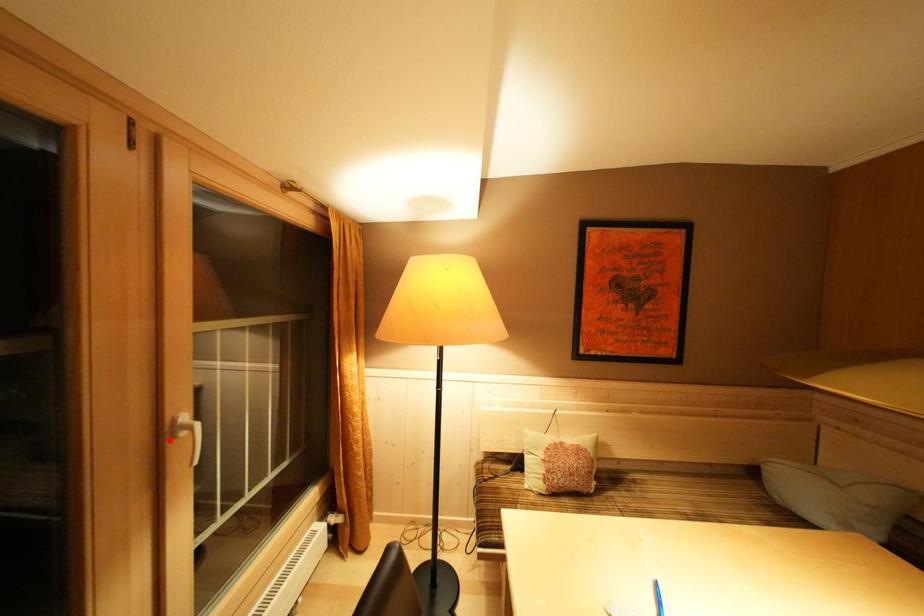
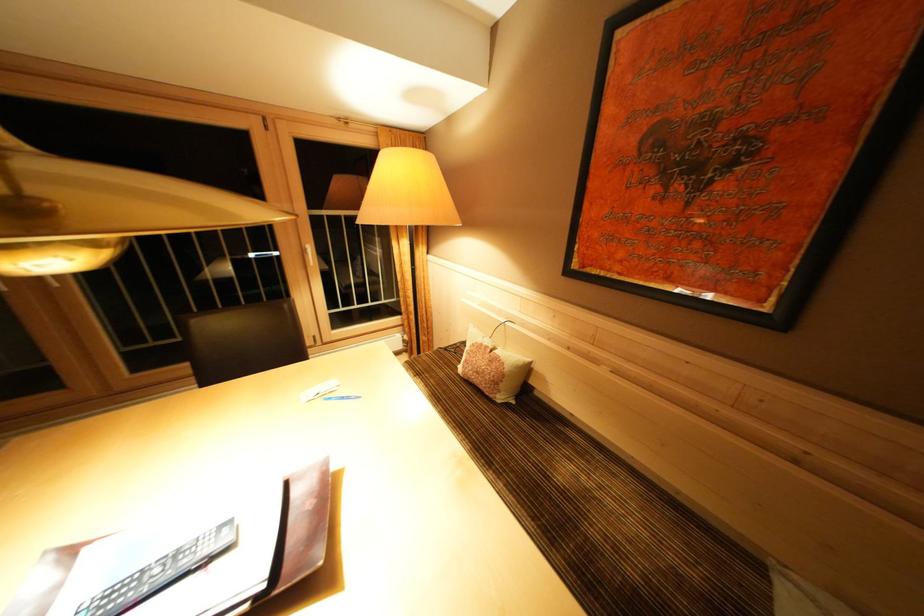
Question: I am providing you with two images of the same scene from different viewpoints. A red point is marked on the first image. Can you still see the location of the red point in image 2?

Choices:
 (A) Yes
 (B) No

Answer: (A)